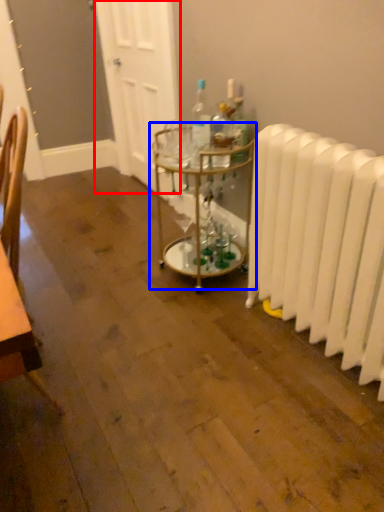
Question: Which object appears closest to the camera in this image, door (highlighted by a red box) or table (highlighted by a blue box)?

Choices:
 (A) door
 (B) table

Answer: (B)